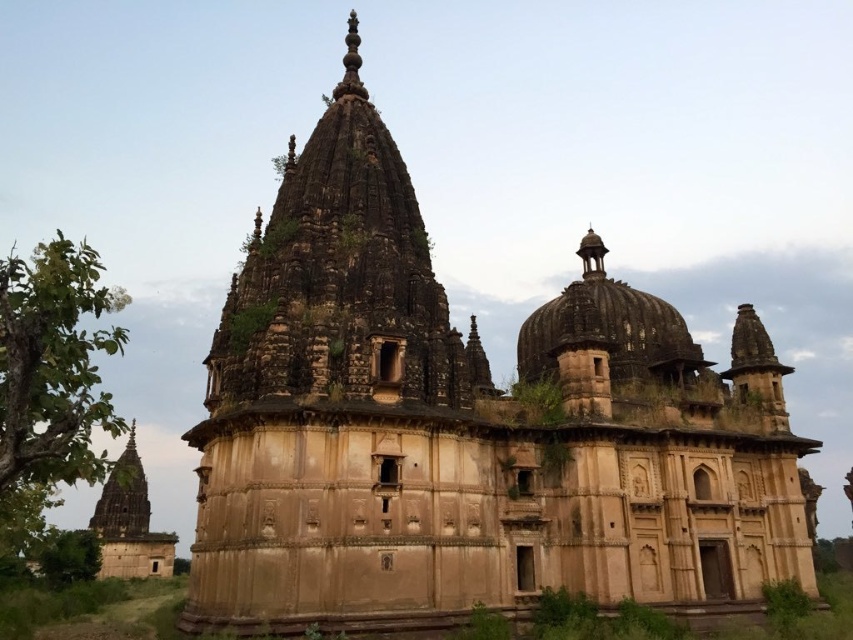
Question: Is brown stone dome at center to the left of brown stone tower at lower left from the viewer's perspective?

Choices:
 (A) yes
 (B) no

Answer: (B)

Question: Among these points, which one is farthest from the camera?

Choices:
 (A) (634, 312)
 (B) (131, 532)

Answer: (B)

Question: Which point is farther to the camera?

Choices:
 (A) (697, 353)
 (B) (126, 541)

Answer: (B)

Question: Which point is closer to the camera taking this photo?

Choices:
 (A) (564, 307)
 (B) (106, 516)

Answer: (A)

Question: Observing the image, what is the correct spatial positioning of brown stone dome at center in reference to brown stone tower at lower left?

Choices:
 (A) below
 (B) above

Answer: (B)

Question: In this image, where is brown stone dome at center located relative to brown stone tower at lower left?

Choices:
 (A) below
 (B) above

Answer: (B)